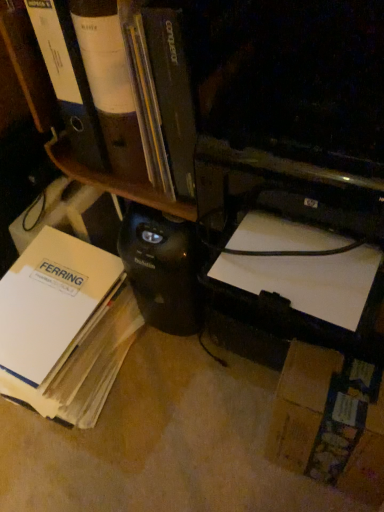
Question: In the image, is white paper at lower left positioned in front of or behind matte black bookshelf at upper center?

Choices:
 (A) front
 (B) behind

Answer: (B)

Question: From their relative heights in the image, would you say white paper at lower left is taller or shorter than matte black bookshelf at upper center?

Choices:
 (A) short
 (B) tall

Answer: (A)

Question: Looking at their shapes, would you say white paper at lower left is wider or thinner than matte black bookshelf at upper center?

Choices:
 (A) wide
 (B) thin

Answer: (A)

Question: Looking at their shapes, would you say matte black bookshelf at upper center is wider or thinner than white paper at lower left?

Choices:
 (A) thin
 (B) wide

Answer: (A)

Question: Is matte black bookshelf at upper center situated inside white paper at lower left or outside?

Choices:
 (A) outside
 (B) inside

Answer: (A)

Question: From their relative heights in the image, would you say matte black bookshelf at upper center is taller or shorter than white paper at lower left?

Choices:
 (A) short
 (B) tall

Answer: (B)

Question: From a real-world perspective, relative to white paper at lower left, is matte black bookshelf at upper center vertically above or below?

Choices:
 (A) below
 (B) above

Answer: (B)